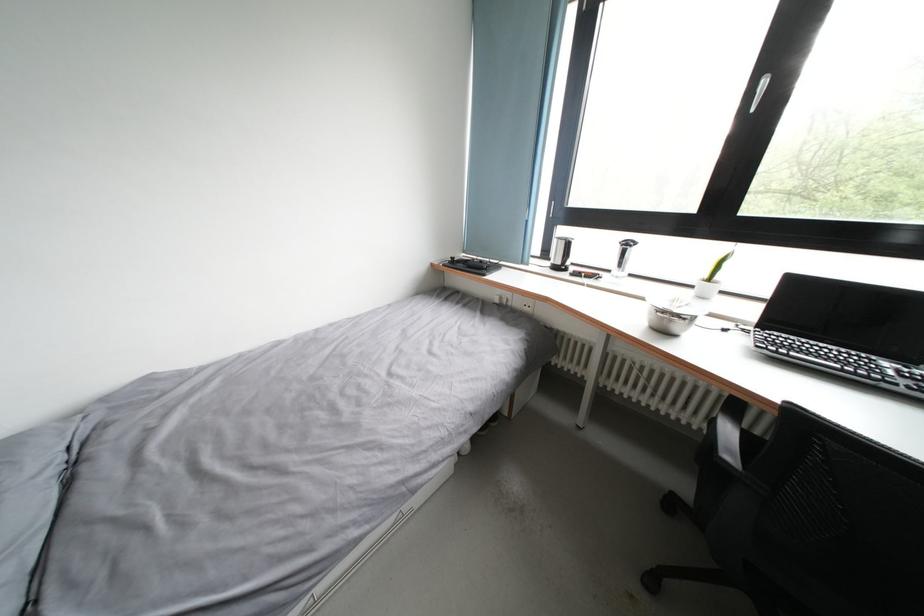
Find where to lift the silver metal bowl. Please return your answer as a coordinate pair (x, y).

(671, 314)